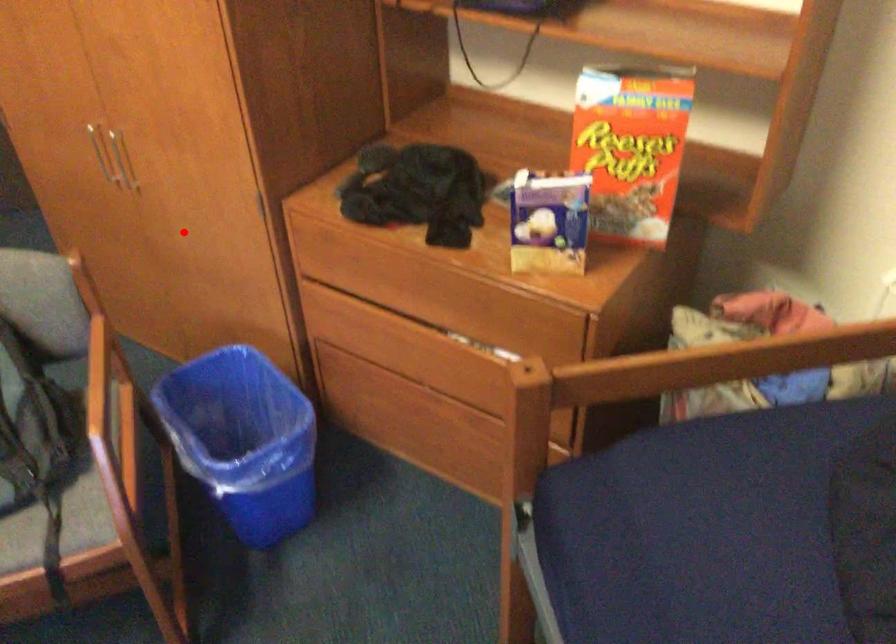
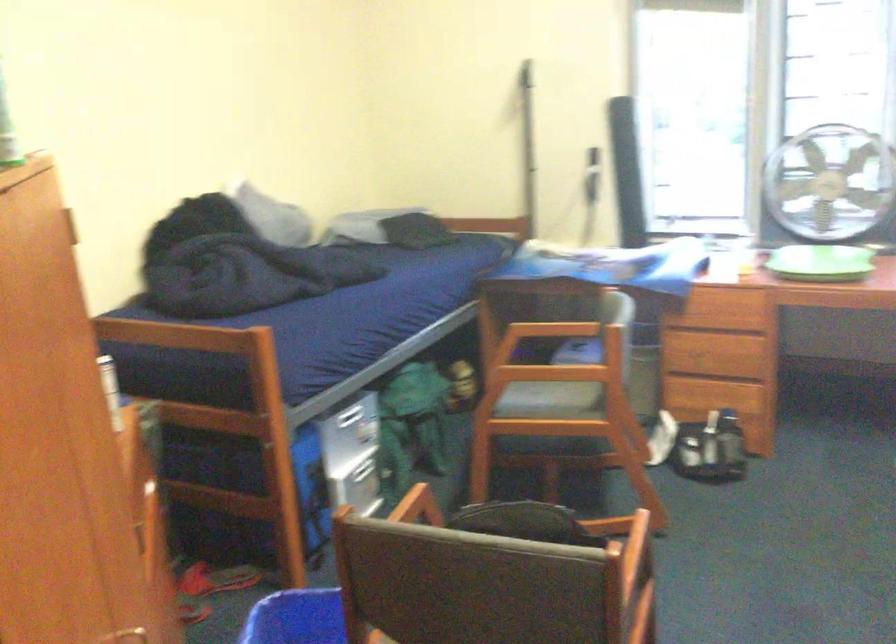
Question: I am providing you with two images of the same scene from different viewpoints. A red point is shown in image1. For the corresponding object point in image2, is it positioned nearer or farther from the camera?

Choices:
 (A) Nearer
 (B) Farther

Answer: (A)